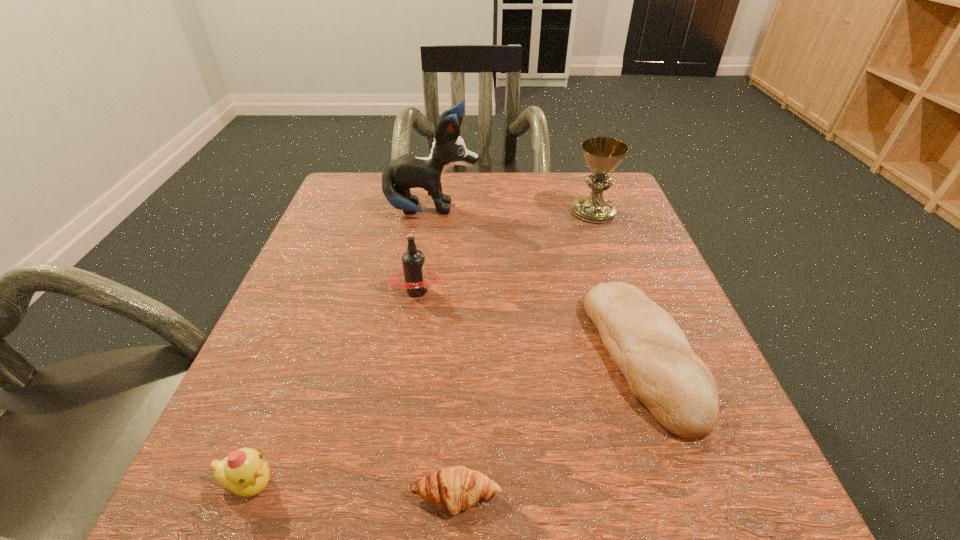
At what (x,y) coordinates should I click in order to perform the action: click on blank area in the image that satisfies the following two spatial constraints: 1. on the front side of the second tallest object; 2. on the front-facing side of the leftmost object. Please return your answer as a coordinate pair (x, y). Image resolution: width=960 pixels, height=540 pixels. Looking at the image, I should click on (691, 484).

At what (x,y) coordinates should I click in order to perform the action: click on vacant area in the image that satisfies the following two spatial constraints: 1. on the label of the root beer; 2. on the left side of the second shortest object. Please return your answer as a coordinate pair (x, y). The image size is (960, 540). Looking at the image, I should click on (408, 355).